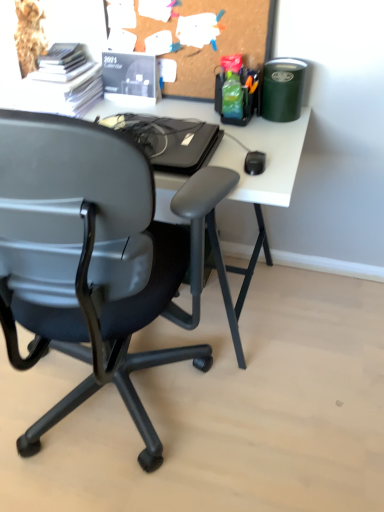
What do you see at coordinates (266, 160) in the screenshot?
I see `white matte computer desk at upper center` at bounding box center [266, 160].

Measure the distance between point (278,62) and camera.

Point (278,62) is 4.62 feet from camera.

What is the approximate width of white paper stack at upper left, which appears as the fourth stationery when viewed from the right?

It is 12.73 inches.

What are the coordinates of `matte black calendar at upper center, which ranks as the 3th stationery in right-to-left order` in the screenshot? It's located at (130, 78).

Locate an element on the screen. white matte computer desk at upper center is located at coordinates (266, 160).

Considering the relative sizes of translucent plastic organizer at upper right, acting as the second stationery starting from the right, and corkboard at upper center in the image provided, is translucent plastic organizer at upper right, acting as the second stationery starting from the right, thinner than corkboard at upper center?

No, translucent plastic organizer at upper right, acting as the second stationery starting from the right, is not thinner than corkboard at upper center.

You are a GUI agent. You are given a task and a screenshot of the screen. Output one action in this format:
    pyautogui.click(x=<x>, y=<y>)
    Task: Click on the stationery that is the 2nd object located behind the corkboard at upper center
    
    Given the screenshot: What is the action you would take?
    pyautogui.click(x=237, y=91)

Can you confirm if translucent plastic organizer at upper right, the 3th stationery from the left, is positioned to the left of corkboard at upper center?

In fact, translucent plastic organizer at upper right, the 3th stationery from the left, is to the right of corkboard at upper center.

Does green matte trash can at upper right, which ranks as the 1th stationery in right-to-left order, turn towards white paper stack at upper left, which appears as the fourth stationery when viewed from the right?

No.

From the image's perspective, between green matte trash can at upper right, the 4th stationery in the left-to-right sequence, and white paper stack at upper left, arranged as the 1th stationery when viewed from the left, who is located below?

green matte trash can at upper right, the 4th stationery in the left-to-right sequence, is shown below in the image.

Which stationery is the 2nd one when counting from the front of the white paper stack at upper left, arranged as the 1th stationery when viewed from the left? Please provide its 2D coordinates.

[(282, 89)]

Would you say green matte trash can at upper right, which ranks as the 1th stationery in right-to-left order, is a long distance from white paper stack at upper left, which appears as the fourth stationery when viewed from the right?

No, green matte trash can at upper right, which ranks as the 1th stationery in right-to-left order, is not far from white paper stack at upper left, which appears as the fourth stationery when viewed from the right.

Can you confirm if translucent plastic organizer at upper right, the 3th stationery from the left, is shorter than white paper stack at upper left, arranged as the 1th stationery when viewed from the left?

No, translucent plastic organizer at upper right, the 3th stationery from the left, is not shorter than white paper stack at upper left, arranged as the 1th stationery when viewed from the left.

Does translucent plastic organizer at upper right, acting as the second stationery starting from the right, have a greater width compared to white paper stack at upper left, which appears as the fourth stationery when viewed from the right?

In fact, translucent plastic organizer at upper right, acting as the second stationery starting from the right, might be narrower than white paper stack at upper left, which appears as the fourth stationery when viewed from the right.

Between point (240, 63) and point (93, 67), which one is positioned in front?

Positioned in front is point (240, 63).

From the image's perspective, who appears lower, white paper stack at upper left, arranged as the 1th stationery when viewed from the left, or translucent plastic organizer at upper right, acting as the second stationery starting from the right?

translucent plastic organizer at upper right, acting as the second stationery starting from the right, appears lower in the image.

From the picture: Does white paper stack at upper left, arranged as the 1th stationery when viewed from the left, come in front of translucent plastic organizer at upper right, the 3th stationery from the left?

That is False.

From the picture: Could you measure the distance between white paper stack at upper left, which appears as the fourth stationery when viewed from the right, and translucent plastic organizer at upper right, acting as the second stationery starting from the right?

white paper stack at upper left, which appears as the fourth stationery when viewed from the right, and translucent plastic organizer at upper right, acting as the second stationery starting from the right, are 53.96 centimeters apart.

Is white paper stack at upper left, which appears as the fourth stationery when viewed from the right, aimed at translucent plastic organizer at upper right, the 3th stationery from the left?

No, white paper stack at upper left, which appears as the fourth stationery when viewed from the right, is not oriented towards translucent plastic organizer at upper right, the 3th stationery from the left.

Looking at the image, does green matte trash can at upper right, the 4th stationery in the left-to-right sequence, seem bigger or smaller compared to translucent plastic organizer at upper right, the 3th stationery from the left?

In the image, green matte trash can at upper right, the 4th stationery in the left-to-right sequence, appears to be larger than translucent plastic organizer at upper right, the 3th stationery from the left.

Measure the distance between green matte trash can at upper right, the 4th stationery in the left-to-right sequence, and translucent plastic organizer at upper right, the 3th stationery from the left.

green matte trash can at upper right, the 4th stationery in the left-to-right sequence, and translucent plastic organizer at upper right, the 3th stationery from the left, are 3.39 inches apart from each other.

From the image's perspective, who appears lower, green matte trash can at upper right, which ranks as the 1th stationery in right-to-left order, or translucent plastic organizer at upper right, the 3th stationery from the left?

green matte trash can at upper right, which ranks as the 1th stationery in right-to-left order, appears lower in the image.

Between green matte trash can at upper right, which ranks as the 1th stationery in right-to-left order, and translucent plastic organizer at upper right, the 3th stationery from the left, which one has larger width?

green matte trash can at upper right, which ranks as the 1th stationery in right-to-left order, is wider.

Considering the positions of objects white paper stack at upper left, arranged as the 1th stationery when viewed from the left, and green matte trash can at upper right, the 4th stationery in the left-to-right sequence, in the image provided, who is in front, white paper stack at upper left, arranged as the 1th stationery when viewed from the left, or green matte trash can at upper right, the 4th stationery in the left-to-right sequence,?

green matte trash can at upper right, the 4th stationery in the left-to-right sequence, is more forward.

Which object is positioned more to the left, white paper stack at upper left, arranged as the 1th stationery when viewed from the left, or green matte trash can at upper right, which ranks as the 1th stationery in right-to-left order?

white paper stack at upper left, arranged as the 1th stationery when viewed from the left.

Based on the photo, is white paper stack at upper left, arranged as the 1th stationery when viewed from the left, looking in the opposite direction of green matte trash can at upper right, which ranks as the 1th stationery in right-to-left order?

No, white paper stack at upper left, arranged as the 1th stationery when viewed from the left, is not facing the opposite direction of green matte trash can at upper right, which ranks as the 1th stationery in right-to-left order.

Which is farther from the camera, (26, 89) or (266, 88)?

The point (26, 89) is farther.

Does matte black calendar at upper center, the second stationery in the left-to-right sequence, lie in front of green matte trash can at upper right, which ranks as the 1th stationery in right-to-left order?

No, matte black calendar at upper center, the second stationery in the left-to-right sequence, is further to the viewer.

Between matte black calendar at upper center, which ranks as the 3th stationery in right-to-left order, and green matte trash can at upper right, which ranks as the 1th stationery in right-to-left order, which one appears on the left side from the viewer's perspective?

matte black calendar at upper center, which ranks as the 3th stationery in right-to-left order.

What's the angular difference between matte black calendar at upper center, which ranks as the 3th stationery in right-to-left order, and green matte trash can at upper right, the 4th stationery in the left-to-right sequence,'s facing directions?

matte black calendar at upper center, which ranks as the 3th stationery in right-to-left order, and green matte trash can at upper right, the 4th stationery in the left-to-right sequence, are facing 2.47 degrees away from each other.

Is green matte trash can at upper right, the 4th stationery in the left-to-right sequence, at the back of matte black calendar at upper center, the second stationery in the left-to-right sequence?

No, green matte trash can at upper right, the 4th stationery in the left-to-right sequence, is not at the back of matte black calendar at upper center, the second stationery in the left-to-right sequence.

Locate an element on the screen. This screenshot has width=384, height=512. bulletin board on the left of translucent plastic organizer at upper right, acting as the second stationery starting from the right is located at coordinates (197, 36).

You are a GUI agent. You are given a task and a screenshot of the screen. Output one action in this format:
    pyautogui.click(x=<x>, y=<y>)
    Task: Click on the 2nd stationery located above the white paper stack at upper left, which appears as the fourth stationery when viewed from the right (from a real-world perspective)
    The image size is (384, 512).
    Given the screenshot: What is the action you would take?
    pyautogui.click(x=282, y=89)

From the image, which object appears to be farther from translucent plastic organizer at upper right, acting as the second stationery starting from the right, white paper stack at upper left, which appears as the fourth stationery when viewed from the right, or matte black calendar at upper center, the second stationery in the left-to-right sequence?

white paper stack at upper left, which appears as the fourth stationery when viewed from the right, is further to translucent plastic organizer at upper right, acting as the second stationery starting from the right.

From the image, which object appears to be farther from green matte trash can at upper right, the 4th stationery in the left-to-right sequence, matte black calendar at upper center, the second stationery in the left-to-right sequence, or corkboard at upper center?

matte black calendar at upper center, the second stationery in the left-to-right sequence, is positioned further to the anchor green matte trash can at upper right, the 4th stationery in the left-to-right sequence.

Estimate the real-world distances between objects in this image. Which object is closer to matte black calendar at upper center, the second stationery in the left-to-right sequence, white matte computer desk at upper center or white paper stack at upper left, which appears as the fourth stationery when viewed from the right?

Based on the image, white paper stack at upper left, which appears as the fourth stationery when viewed from the right, appears to be nearer to matte black calendar at upper center, the second stationery in the left-to-right sequence.

When comparing their distances from matte black calendar at upper center, which ranks as the 3th stationery in right-to-left order, does white paper stack at upper left, arranged as the 1th stationery when viewed from the left, or white matte computer desk at upper center seem further?

white matte computer desk at upper center.

Looking at the image, which one is located further to white matte computer desk at upper center, green matte trash can at upper right, which ranks as the 1th stationery in right-to-left order, or white paper stack at upper left, arranged as the 1th stationery when viewed from the left?

white paper stack at upper left, arranged as the 1th stationery when viewed from the left.

When comparing their distances from matte black calendar at upper center, which ranks as the 3th stationery in right-to-left order, does corkboard at upper center or translucent plastic organizer at upper right, the 3th stationery from the left, seem further?

Among the two, translucent plastic organizer at upper right, the 3th stationery from the left, is located further to matte black calendar at upper center, which ranks as the 3th stationery in right-to-left order.

When comparing their distances from matte black calendar at upper center, which ranks as the 3th stationery in right-to-left order, does white paper stack at upper left, which appears as the fourth stationery when viewed from the right, or translucent plastic organizer at upper right, the 3th stationery from the left, seem closer?

Among the two, white paper stack at upper left, which appears as the fourth stationery when viewed from the right, is located nearer to matte black calendar at upper center, which ranks as the 3th stationery in right-to-left order.

Based on their spatial positions, is white matte computer desk at upper center or white paper stack at upper left, arranged as the 1th stationery when viewed from the left, closer to corkboard at upper center?

white matte computer desk at upper center is closer to corkboard at upper center.

Find the location of a particular element. The height and width of the screenshot is (512, 384). stationery between corkboard at upper center and green matte trash can at upper right, the 4th stationery in the left-to-right sequence, in the horizontal direction is located at coordinates (237, 91).

At what (x,y) coordinates should I click in order to perform the action: click on stationery between white paper stack at upper left, which appears as the fourth stationery when viewed from the right, and corkboard at upper center, in the horizontal direction. Please return your answer as a coordinate pair (x, y). Looking at the image, I should click on (130, 78).

At what (x,y) coordinates should I click in order to perform the action: click on bulletin board between white paper stack at upper left, arranged as the 1th stationery when viewed from the left, and translucent plastic organizer at upper right, the 3th stationery from the left, in the horizontal direction. Please return your answer as a coordinate pair (x, y). Looking at the image, I should click on (197, 36).

Where is `bulletin board situated between white paper stack at upper left, which appears as the fourth stationery when viewed from the right, and green matte trash can at upper right, which ranks as the 1th stationery in right-to-left order, from left to right`? This screenshot has width=384, height=512. bulletin board situated between white paper stack at upper left, which appears as the fourth stationery when viewed from the right, and green matte trash can at upper right, which ranks as the 1th stationery in right-to-left order, from left to right is located at coordinates (197, 36).